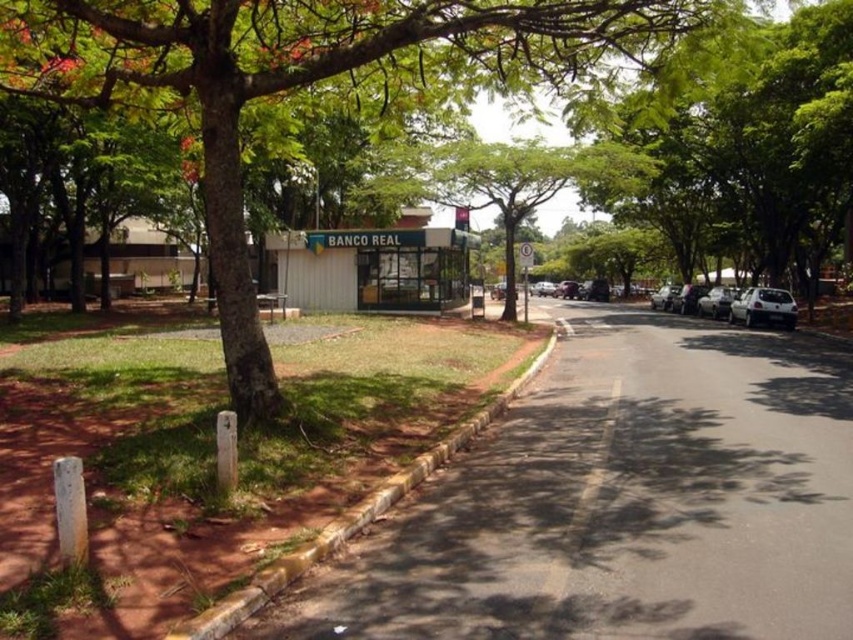
Question: Among these points, which one is nearest to the camera?

Choices:
 (A) (550, 608)
 (B) (780, 314)
 (C) (218, 604)
 (D) (239, 161)

Answer: (C)

Question: Can you confirm if green leafy tree at center is wider than yellow concrete curb at lower left?

Choices:
 (A) yes
 (B) no

Answer: (A)

Question: Which point is closer to the camera?

Choices:
 (A) yellow concrete curb at lower left
 (B) green leafy tree at center

Answer: (A)

Question: Is green leafy tree at center thinner than white matte car at right?

Choices:
 (A) no
 (B) yes

Answer: (A)

Question: Which object is closer to the camera taking this photo?

Choices:
 (A) yellow concrete curb at lower left
 (B) black asphalt road at center

Answer: (A)

Question: Is green leafy tree at center closer to camera compared to black asphalt road at center?

Choices:
 (A) yes
 (B) no

Answer: (B)